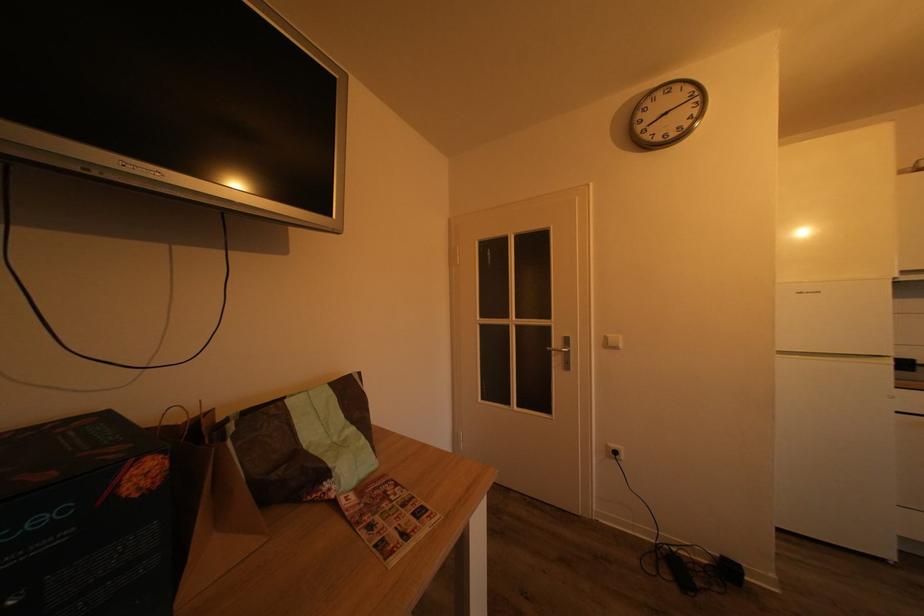
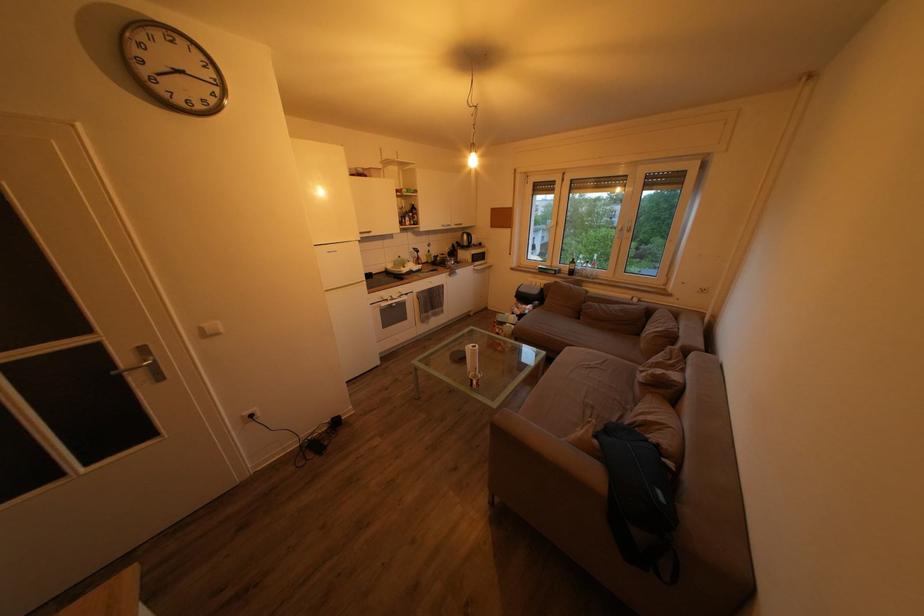
The first image is from the beginning of the video and the second image is from the end. How did the camera likely rotate when shooting the video?

The rotation direction of the camera is right-down.